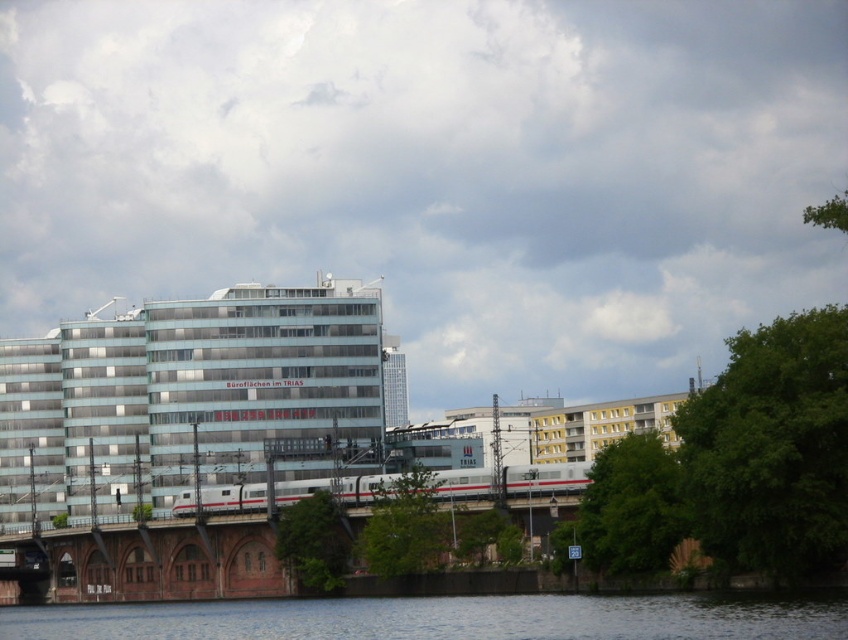
You are a pedestrian standing at the edge of the transparent water at lower center. You want to cross to the silver metallic train at center. Which direction should you walk to reach the train?

You should walk to the right to reach the silver metallic train at center because the transparent water at lower center is to the left of it.

You are a photographer standing in front of the office building. You want to capture a photo where the transparent water at lower center and the silver metallic train at center are both visible. Which object will appear larger in the photo?

The transparent water at lower center will appear larger in the photo because it is much taller than the silver metallic train at center.

You are an architect planning to install a large banner between the light blue glass building at center and the silver metallic train at center. Considering their widths, which object should the banner be anchored to for stability?

The light blue glass building at center is wider than the silver metallic train at center, so anchoring the banner to the light blue glass building at center would provide better stability due to its greater width.